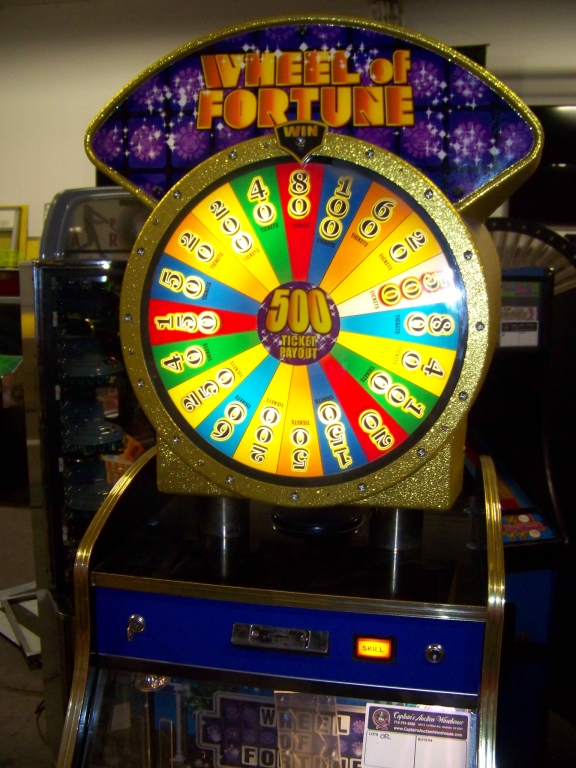
Find the location of a particular element. The width and height of the screenshot is (576, 768). frame is located at coordinates (22, 643).